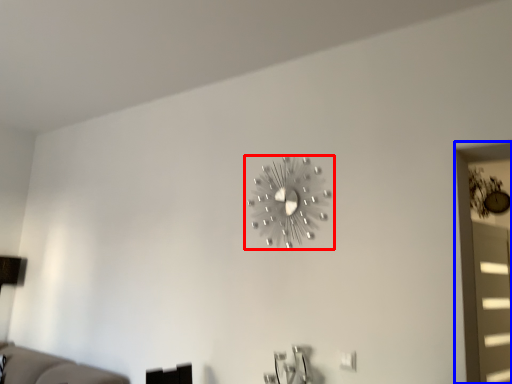
Question: Which point is further to the camera, wall clock (highlighted by a red box) or window (highlighted by a blue box)?

Choices:
 (A) wall clock
 (B) window

Answer: (B)